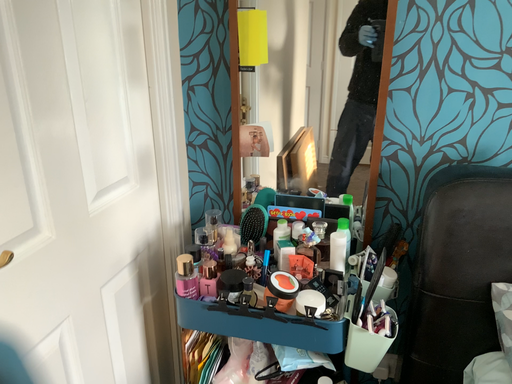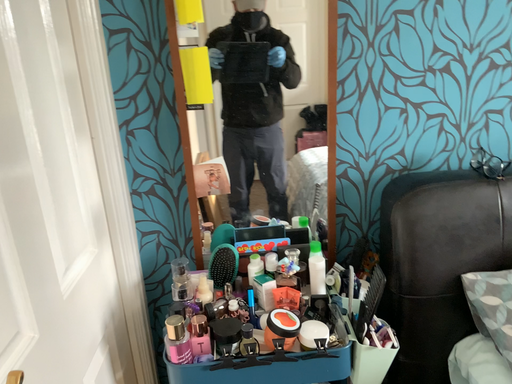
Question: Which way did the camera rotate in the video?

Choices:
 (A) rotated right
 (B) rotated left

Answer: (A)